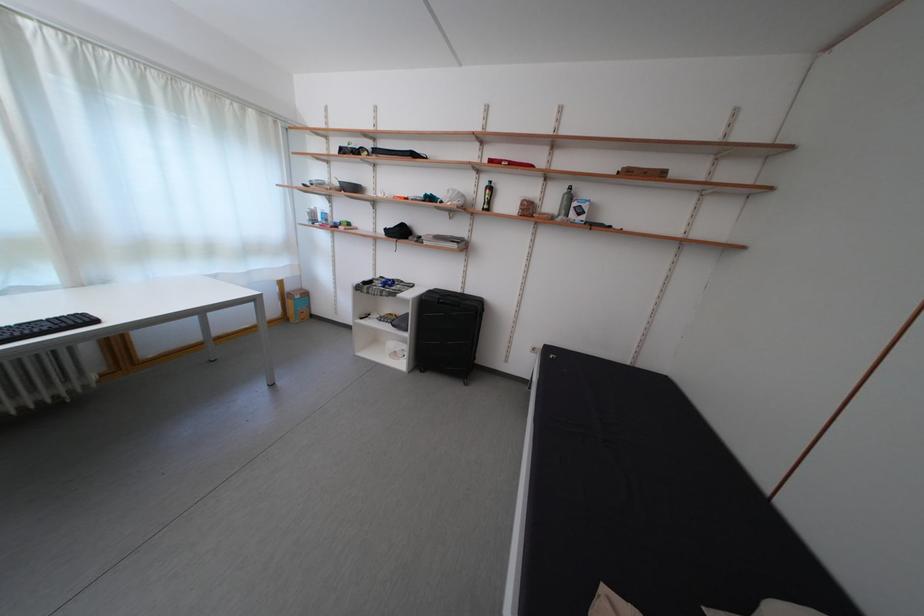
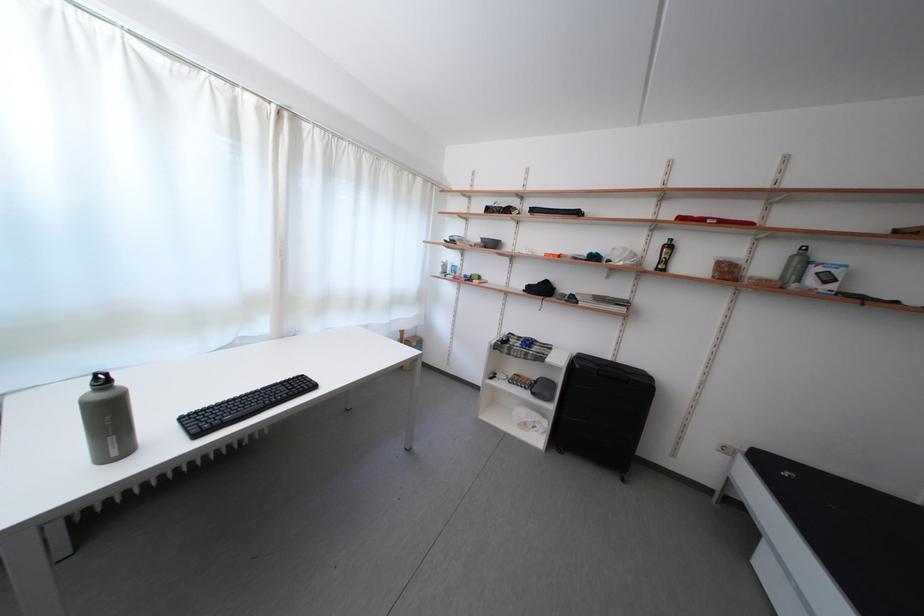
Question: What movement of the cameraman would produce the second image?

Choices:
 (A) Left
 (B) Right
 (C) Forward
 (D) Backward

Answer: (A)